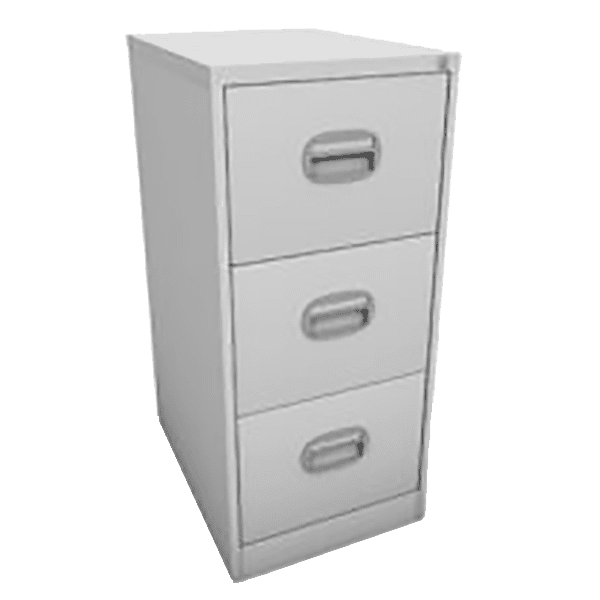
You are a GUI agent. You are given a task and a screenshot of the screen. Output one action in this format:
    pyautogui.click(x=<x>, y=<y>)
    Task: Click on the three drawers
    
    Given the screenshot: What is the action you would take?
    286,489, 286,371, 275,241